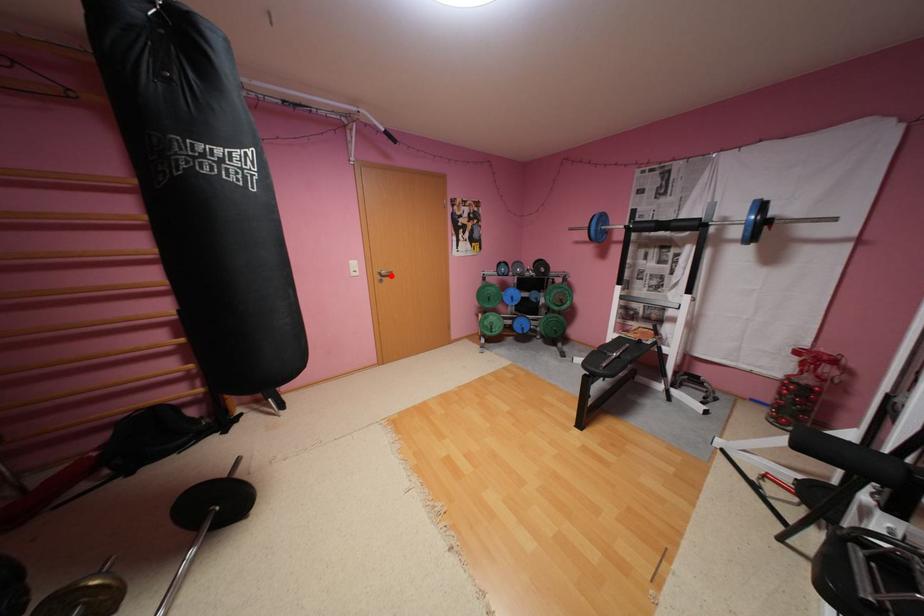
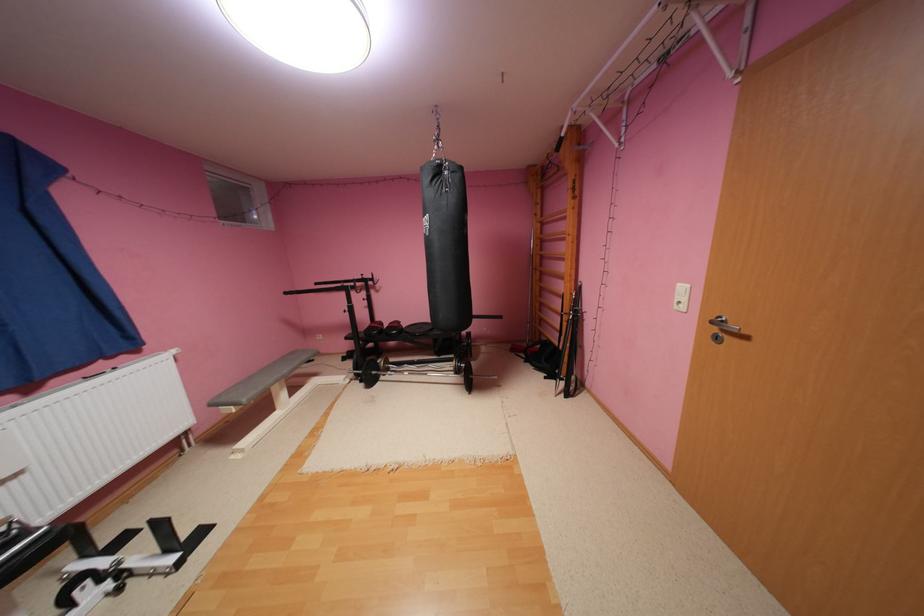
Question: I am providing you with two images of the same scene from different viewpoints. A red point is marked on the first image. Is the red point's position out of view in image 2?

Choices:
 (A) Yes
 (B) No

Answer: (B)